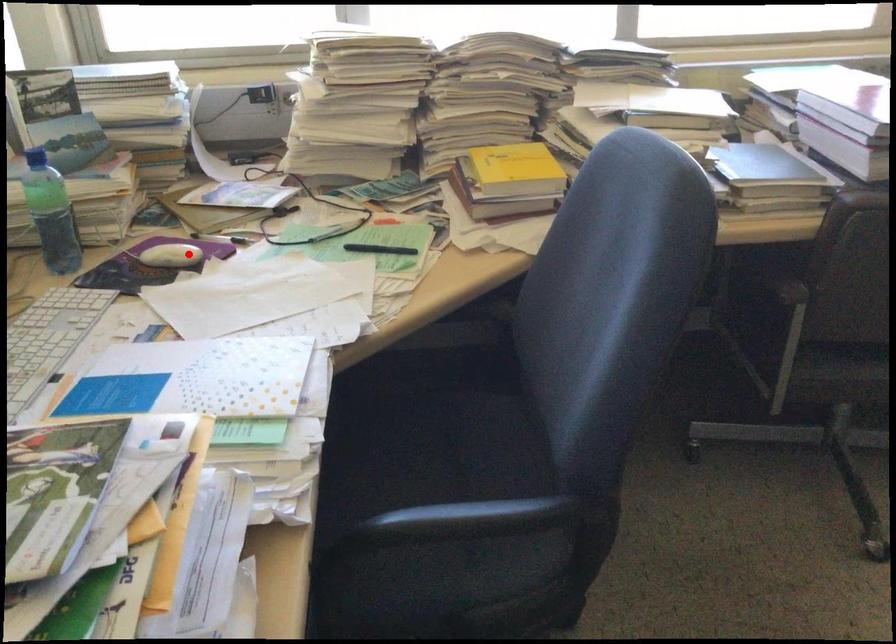
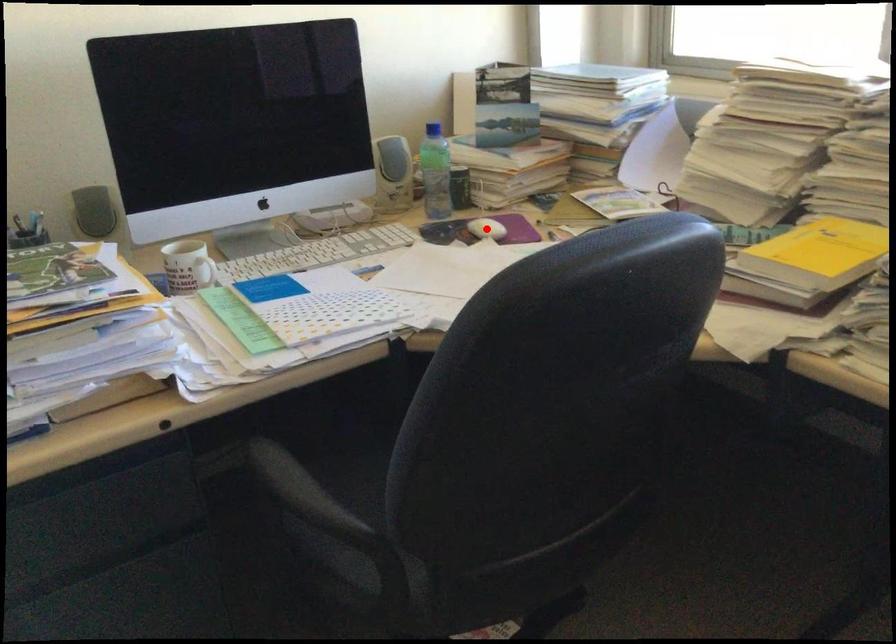
I am providing you with two images of the same scene from different viewpoints. A red point is marked on the first image and another point is marked on the second image. Is the marked point in image1 the same physical position as the marked point in image2?

Yes